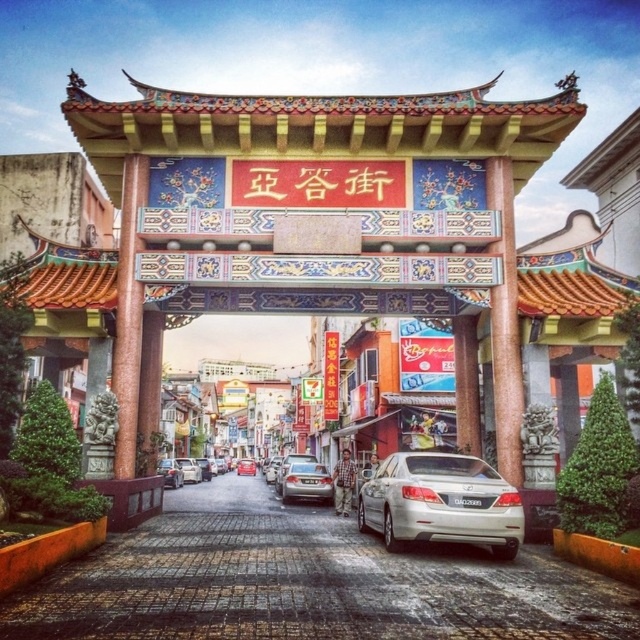
Question: Can you confirm if shiny silver sedan at center is wider than metallic silver sedan at center?

Choices:
 (A) no
 (B) yes

Answer: (A)

Question: Which object is farther from the camera taking this photo?

Choices:
 (A) satin silver sedan at center
 (B) silver metallic sedan at center
 (C) silver metallic car at center
 (D) shiny silver sedan at center

Answer: (C)

Question: From the image, what is the correct spatial relationship of silver metallic sedan at center in relation to satin silver sedan at center?

Choices:
 (A) above
 (B) below

Answer: (A)

Question: Which of the following is the farthest from the observer?

Choices:
 (A) silver metallic sedan at center
 (B) satin silver sedan at center
 (C) silver metallic car at center
 (D) metallic silver sedan at center

Answer: (D)

Question: Estimate the real-world distances between objects in this image. Which object is closer to the satin silver sedan at center?

Choices:
 (A) silver metallic car at center
 (B) shiny silver sedan at center
 (C) silver metallic sedan at center
 (D) metallic silver sedan at center

Answer: (B)

Question: Where is satin silver sedan at center located in relation to shiny silver sedan at center in the image?

Choices:
 (A) below
 (B) above

Answer: (B)